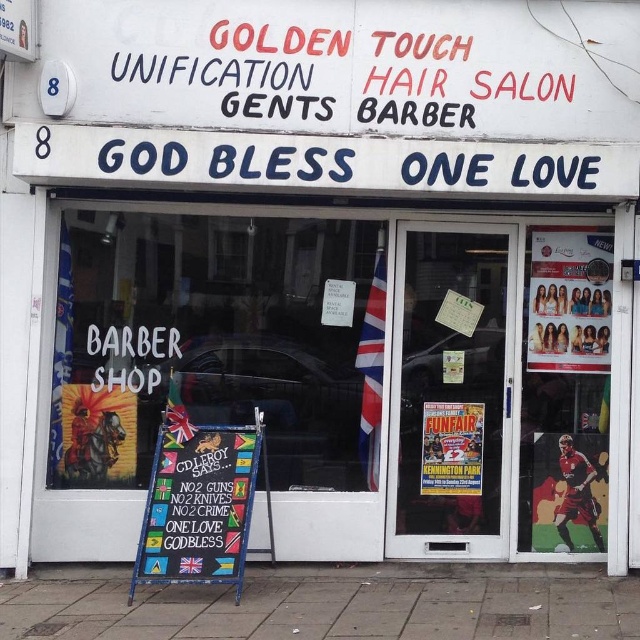
Question: Among these points, which one is farthest from the camera?

Choices:
 (A) (276, 365)
 (B) (426, 417)
 (C) (557, 515)
 (D) (545, 353)

Answer: (A)

Question: From the image, what is the correct spatial relationship of transparent glass barber shop sign at center in relation to wooden signboard at center?

Choices:
 (A) below
 (B) above

Answer: (B)

Question: Which object is the farthest from the transparent glass barber shop sign at center?

Choices:
 (A) red fabric soccer player at lower right
 (B) metallic glossy poster at upper right

Answer: (A)

Question: Which of these objects is positioned closest to the paper poster at center?

Choices:
 (A) metallic glossy poster at upper right
 (B) red fabric soccer player at lower right

Answer: (B)

Question: Is the position of transparent glass door at center more distant than that of wooden signboard at center?

Choices:
 (A) yes
 (B) no

Answer: (A)

Question: Is transparent glass barber shop sign at center thinner than red fabric soccer player at lower right?

Choices:
 (A) no
 (B) yes

Answer: (A)